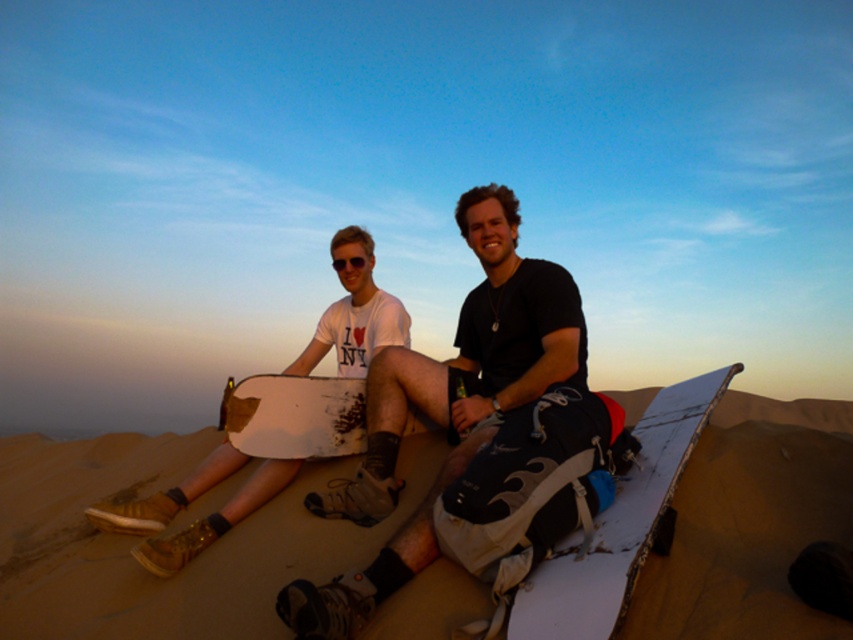
Question: Among these points, which one is nearest to the camera?

Choices:
 (A) (469, 397)
 (B) (651, 480)
 (C) (399, 518)
 (D) (190, 476)

Answer: (B)

Question: Does white cotton t-shirt at center have a larger size compared to white matte snowboard at center?

Choices:
 (A) yes
 (B) no

Answer: (A)

Question: Can you confirm if white cotton t-shirt at center is thinner than matte white snowboard at center?

Choices:
 (A) yes
 (B) no

Answer: (B)

Question: Is brown sandy at center smaller than matte white snowboard at center?

Choices:
 (A) yes
 (B) no

Answer: (A)

Question: Which object appears farthest from the camera in this image?

Choices:
 (A) matte white snowboard at center
 (B) brown sandy at center
 (C) white matte snowboard at center
 (D) white cotton t-shirt at center

Answer: (B)

Question: Which object is farther from the camera taking this photo?

Choices:
 (A) matte white snowboard at center
 (B) white matte snowboard at center

Answer: (A)